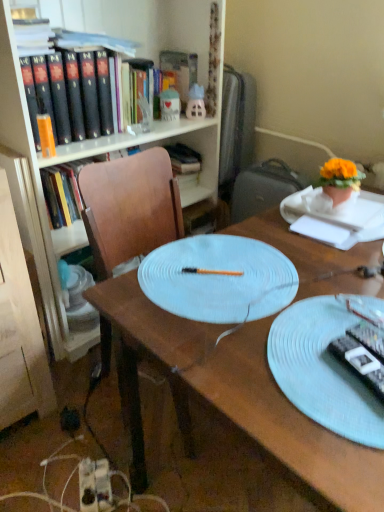
The image size is (384, 512). Find the location of `unoccupied area behind black plastic remote control at right, the first remote control from the right`. unoccupied area behind black plastic remote control at right, the first remote control from the right is located at coordinates (339, 304).